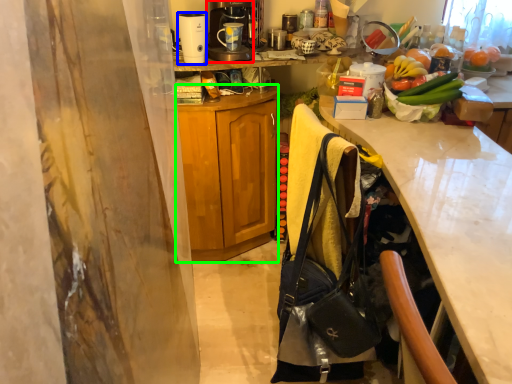
Question: Which object is positioned closest to coffee maker (highlighted by a red box)? Select from kitchen appliance (highlighted by a blue box) and cabinetry (highlighted by a green box).

Choices:
 (A) kitchen appliance
 (B) cabinetry

Answer: (A)